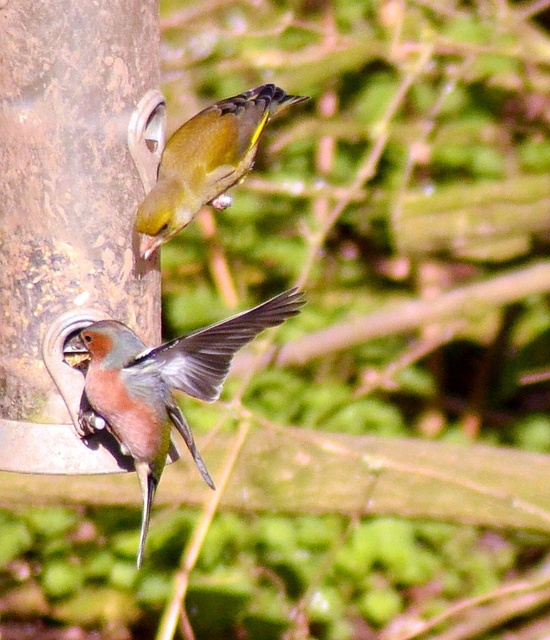
Question: Does brown textured pole at left appear on the left side of brown speckled bird at lower left?

Choices:
 (A) yes
 (B) no

Answer: (A)

Question: Is the position of brown speckled bird at lower left more distant than that of green glossy bird at upper center?

Choices:
 (A) no
 (B) yes

Answer: (A)

Question: Which point is closer to the camera?

Choices:
 (A) (233, 120)
 (B) (150, 36)
 (C) (148, 470)

Answer: (C)

Question: Which of the following is the closest to the observer?

Choices:
 (A) green glossy bird at upper center
 (B) brown textured pole at left
 (C) brown speckled bird at lower left

Answer: (C)

Question: Does brown textured pole at left appear on the right side of brown speckled bird at lower left?

Choices:
 (A) yes
 (B) no

Answer: (B)

Question: Among these points, which one is nearest to the camera?

Choices:
 (A) (282, 106)
 (B) (51, 13)
 (C) (195, 371)

Answer: (C)